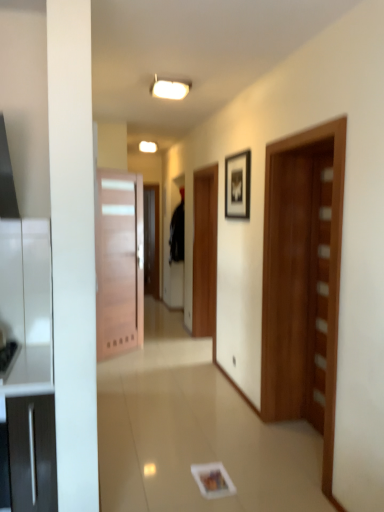
Question: Is wooden door at right, which is counted as the 2th door, starting from the back, facing towards black fabric robe at center?

Choices:
 (A) no
 (B) yes

Answer: (A)

Question: From the image's perspective, does wooden door at right, acting as the 2th door starting from the left, appear higher than black fabric robe at center?

Choices:
 (A) no
 (B) yes

Answer: (A)

Question: Is wooden door at right, which is counted as the 2th door, starting from the back, next to black fabric robe at center and touching it?

Choices:
 (A) yes
 (B) no

Answer: (B)

Question: Is wooden door at right, the first door viewed from the front, at the right side of black fabric robe at center?

Choices:
 (A) no
 (B) yes

Answer: (B)

Question: From a real-world perspective, does wooden door at right, the first door viewed from the front, sit lower than black fabric robe at center?

Choices:
 (A) no
 (B) yes

Answer: (B)

Question: From a real-world perspective, is black matte picture frame at upper center above or below black fabric robe at center?

Choices:
 (A) above
 (B) below

Answer: (A)

Question: From the image's perspective, relative to black fabric robe at center, is black matte picture frame at upper center above or below?

Choices:
 (A) below
 (B) above

Answer: (B)

Question: Is black matte picture frame at upper center inside the boundaries of black fabric robe at center, or outside?

Choices:
 (A) inside
 (B) outside

Answer: (B)

Question: Based on their positions, is black matte picture frame at upper center located to the left or right of black fabric robe at center?

Choices:
 (A) right
 (B) left

Answer: (A)

Question: From a real-world perspective, is wooden door at left, which ranks as the 1th door in left-to-right order, physically located above or below black matte picture frame at upper center?

Choices:
 (A) above
 (B) below

Answer: (B)

Question: Visually, is wooden door at left, marked as the 1th door in a back-to-front arrangement, positioned to the left or to the right of black matte picture frame at upper center?

Choices:
 (A) left
 (B) right

Answer: (A)

Question: Looking at the image, does wooden door at left, which ranks as the 1th door in left-to-right order, seem bigger or smaller compared to black matte picture frame at upper center?

Choices:
 (A) big
 (B) small

Answer: (A)

Question: From the image's perspective, is wooden door at left, which ranks as the 1th door in left-to-right order, positioned above or below black matte picture frame at upper center?

Choices:
 (A) above
 (B) below

Answer: (B)

Question: Is point (182, 201) positioned closer to the camera than point (132, 310)?

Choices:
 (A) farther
 (B) closer

Answer: (A)

Question: Is black fabric robe at center bigger or smaller than wooden door at left, the 2th door from the front?

Choices:
 (A) big
 (B) small

Answer: (A)